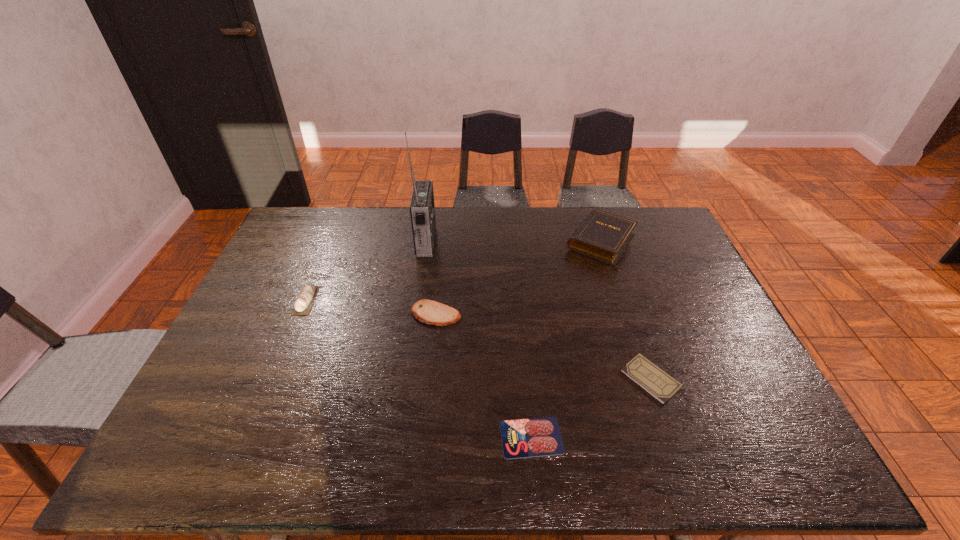
Identify the location of vacant space situated 0.390m on the display of the radio receiver. The image size is (960, 540). (546, 241).

Locate an element on the screen. This screenshot has height=540, width=960. free location located on the left of the Bible is located at coordinates (506, 241).

Locate an element on the screen. vacant space located on the front of the taller pita bread is located at coordinates (262, 406).

You are a GUI agent. You are given a task and a screenshot of the screen. Output one action in this format:
    pyautogui.click(x=<x>, y=<y>)
    Task: Click on the free location located on the back of the right pita bread
    This screenshot has width=960, height=540.
    Given the screenshot: What is the action you would take?
    pyautogui.click(x=444, y=232)

You are a GUI agent. You are given a task and a screenshot of the screen. Output one action in this format:
    pyautogui.click(x=<x>, y=<y>)
    Task: Click on the vacant position located on the back of the second shortest object
    
    Given the screenshot: What is the action you would take?
    pyautogui.click(x=621, y=293)

You are a GUI agent. You are given a task and a screenshot of the screen. Output one action in this format:
    pyautogui.click(x=<x>, y=<y>)
    Task: Click on the blank area located on the back of the shortest object
    
    Given the screenshot: What is the action you would take?
    pyautogui.click(x=528, y=399)

Where is `radio receiver that is at the far edge`? radio receiver that is at the far edge is located at coordinates (422, 208).

Identify the location of Bible at the far edge. Image resolution: width=960 pixels, height=540 pixels. (603, 236).

The height and width of the screenshot is (540, 960). In order to click on object that is at the near edge in this screenshot , I will do [x=522, y=438].

Locate an element on the screen. The height and width of the screenshot is (540, 960). object at the left edge is located at coordinates (303, 304).